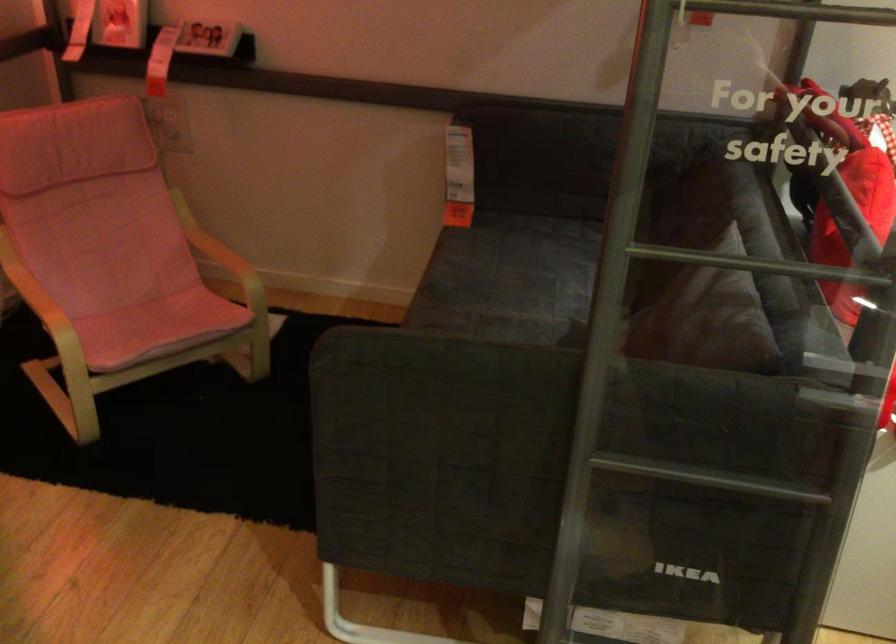
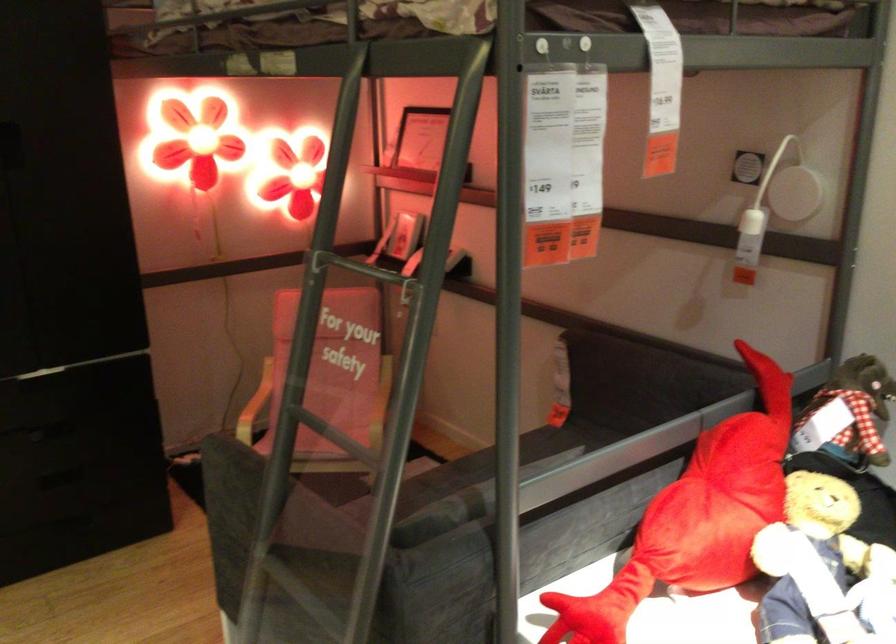
Find the pixel in the second image that matches (x=80, y=296) in the first image.

(252, 406)